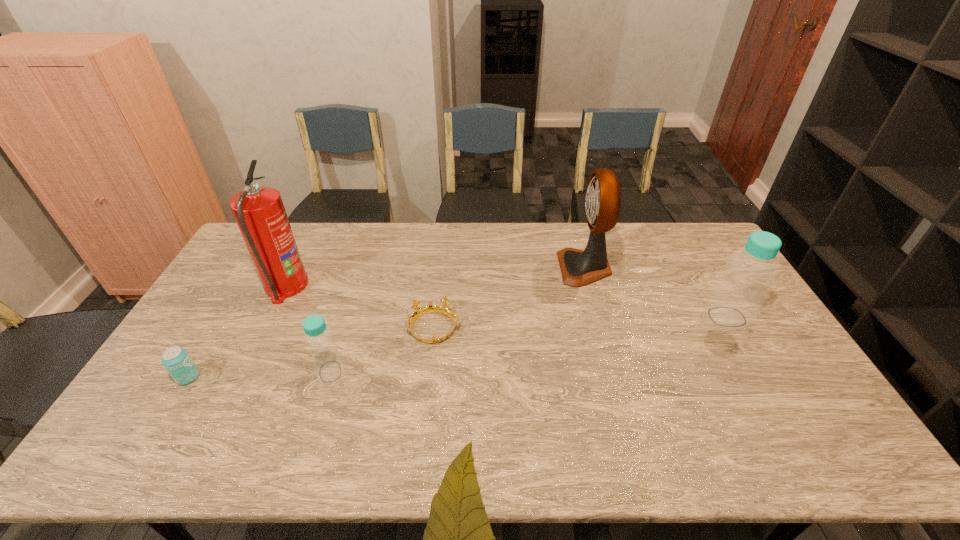
Locate an element on the screen. beer can present at the left edge is located at coordinates (176, 360).

At what (x,y) coordinates should I click in order to perform the action: click on object situated at the right edge. Please return your answer as a coordinate pair (x, y). This screenshot has width=960, height=540. Looking at the image, I should click on (738, 294).

Where is `vacant area at the far edge of the desktop`? vacant area at the far edge of the desktop is located at coordinates (388, 242).

This screenshot has width=960, height=540. Identify the location of free region at the near edge of the desktop. (669, 411).

The image size is (960, 540). I want to click on vacant space at the left edge, so click(239, 272).

At what (x,y) coordinates should I click in order to perform the action: click on blank area at the far left corner. Please return your answer as a coordinate pair (x, y). The width and height of the screenshot is (960, 540). Looking at the image, I should click on (244, 261).

You are a GUI agent. You are given a task and a screenshot of the screen. Output one action in this format:
    pyautogui.click(x=<x>, y=<y>)
    Task: Click on the vacant space at the far right corner of the desktop
    The width and height of the screenshot is (960, 540).
    Given the screenshot: What is the action you would take?
    pyautogui.click(x=677, y=222)

Where is `vacant space at the near right corner of the desktop`? The width and height of the screenshot is (960, 540). vacant space at the near right corner of the desktop is located at coordinates (763, 408).

Locate an element on the screen. This screenshot has width=960, height=540. vacant area that lies between the second object from left to right and the right bottle is located at coordinates (506, 302).

You are a GUI agent. You are given a task and a screenshot of the screen. Output one action in this format:
    pyautogui.click(x=<x>, y=<y>)
    Task: Click on the empty space between the third object from right to left and the second object from right to left
    The height and width of the screenshot is (540, 960).
    Given the screenshot: What is the action you would take?
    pyautogui.click(x=509, y=298)